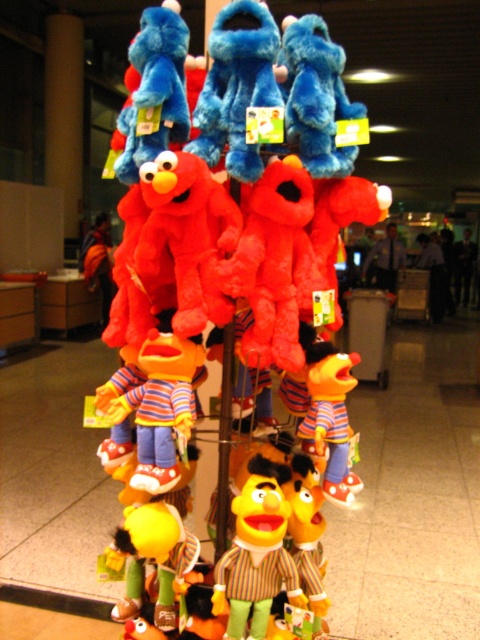
You are a child trying to pick up the fluffy plush at center and the yellow plush bert at center from the pyramid. Which one is easier to grab without moving the other toys?

The yellow plush bert at center is easier to grab because it is smaller than the fluffy plush at center, making it less likely to disturb the other toys when picked up.

You are a child trying to reach the top of the Sesame Street plush toy pyramid. You notice two Berts at the center of the base. Which Bert is closer to you, the yellow plush bert at center or the striped fabric bert at center?

The yellow plush bert at center is closer to you because the striped fabric bert at center is positioned behind it.